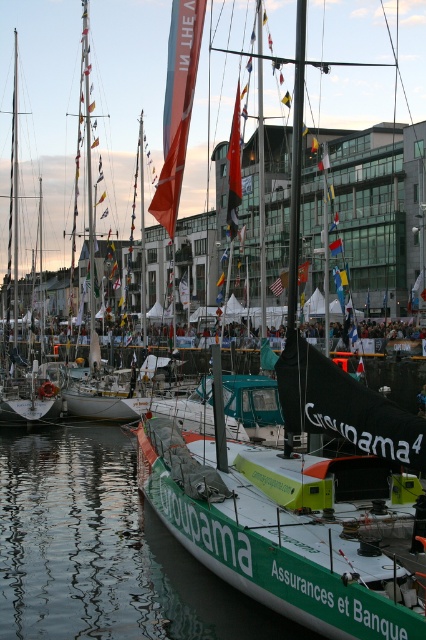
Question: Which object is the farthest from the green matte sailboat at center?

Choices:
 (A) white matte sailboat at left
 (B) green smooth water at lower left

Answer: (A)

Question: Estimate the real-world distances between objects in this image. Which object is closer to the green smooth water at lower left?

Choices:
 (A) white matte sailboat at left
 (B) green matte sailboat at center

Answer: (B)

Question: Is green smooth water at lower left closer to the viewer compared to white matte sailboat at left?

Choices:
 (A) no
 (B) yes

Answer: (B)

Question: Can you confirm if green matte sailboat at center is wider than green smooth water at lower left?

Choices:
 (A) yes
 (B) no

Answer: (B)

Question: Does green matte sailboat at center have a larger size compared to green smooth water at lower left?

Choices:
 (A) yes
 (B) no

Answer: (A)

Question: Which is farther from the green matte sailboat at center?

Choices:
 (A) white matte sailboat at left
 (B) green smooth water at lower left

Answer: (A)